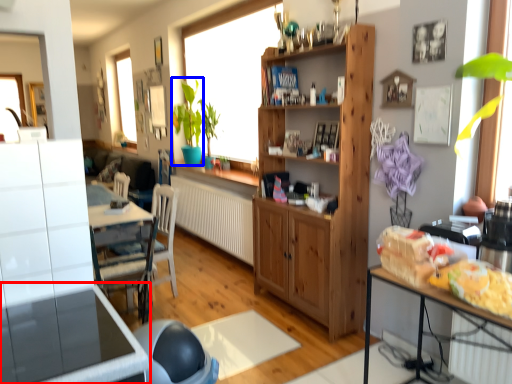
Question: Which object is further to the camera taking this photo, table (highlighted by a red box) or plant (highlighted by a blue box)?

Choices:
 (A) table
 (B) plant

Answer: (B)